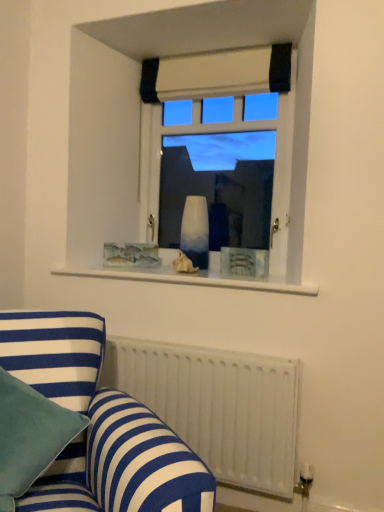
Question: Can you confirm if beige fabric curtain at upper center is wider than blue striped fabric couch at lower left?

Choices:
 (A) no
 (B) yes

Answer: (A)

Question: Is beige fabric curtain at upper center positioned with its back to blue striped fabric couch at lower left?

Choices:
 (A) yes
 (B) no

Answer: (B)

Question: Is beige fabric curtain at upper center taller than blue striped fabric couch at lower left?

Choices:
 (A) yes
 (B) no

Answer: (B)

Question: Is beige fabric curtain at upper center bigger than blue striped fabric couch at lower left?

Choices:
 (A) no
 (B) yes

Answer: (A)

Question: Is beige fabric curtain at upper center next to blue striped fabric couch at lower left and touching it?

Choices:
 (A) no
 (B) yes

Answer: (A)

Question: Would you say white glass vase at upper center is to the left or to the right of teal velvet pillow at lower left in the picture?

Choices:
 (A) right
 (B) left

Answer: (A)

Question: Considering the positions of point (249, 84) and point (6, 390), is point (249, 84) closer or farther from the camera than point (6, 390)?

Choices:
 (A) farther
 (B) closer

Answer: (A)

Question: Considering the positions of white glass vase at upper center and teal velvet pillow at lower left in the image, is white glass vase at upper center taller or shorter than teal velvet pillow at lower left?

Choices:
 (A) short
 (B) tall

Answer: (B)

Question: From the image's perspective, is white glass vase at upper center above or below teal velvet pillow at lower left?

Choices:
 (A) below
 (B) above

Answer: (B)

Question: From their relative heights in the image, would you say white metallic radiator at lower right is taller or shorter than blue striped fabric couch at lower left?

Choices:
 (A) short
 (B) tall

Answer: (A)

Question: From a real-world perspective, is white metallic radiator at lower right positioned above or below blue striped fabric couch at lower left?

Choices:
 (A) above
 (B) below

Answer: (B)

Question: Is white metallic radiator at lower right in front of or behind blue striped fabric couch at lower left in the image?

Choices:
 (A) behind
 (B) front

Answer: (A)

Question: From the image's perspective, is white metallic radiator at lower right positioned above or below blue striped fabric couch at lower left?

Choices:
 (A) above
 (B) below

Answer: (B)

Question: In terms of height, does white metallic radiator at lower right look taller or shorter compared to white glass vase at upper center?

Choices:
 (A) short
 (B) tall

Answer: (A)

Question: Looking at the image, does white metallic radiator at lower right seem bigger or smaller compared to white glass vase at upper center?

Choices:
 (A) big
 (B) small

Answer: (A)